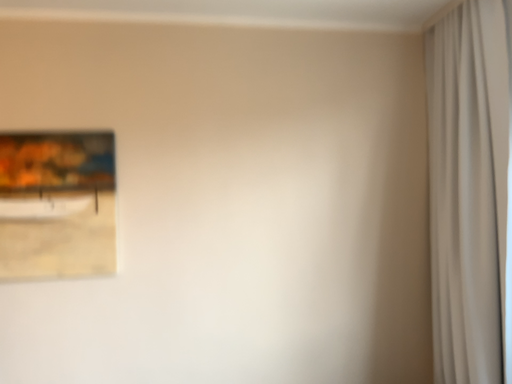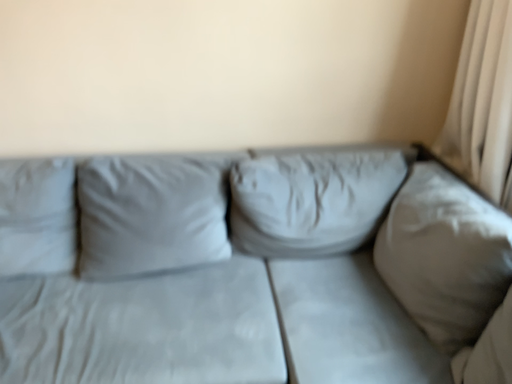
Question: How did the camera likely rotate when shooting the video?

Choices:
 (A) rotated downward
 (B) rotated upward

Answer: (A)